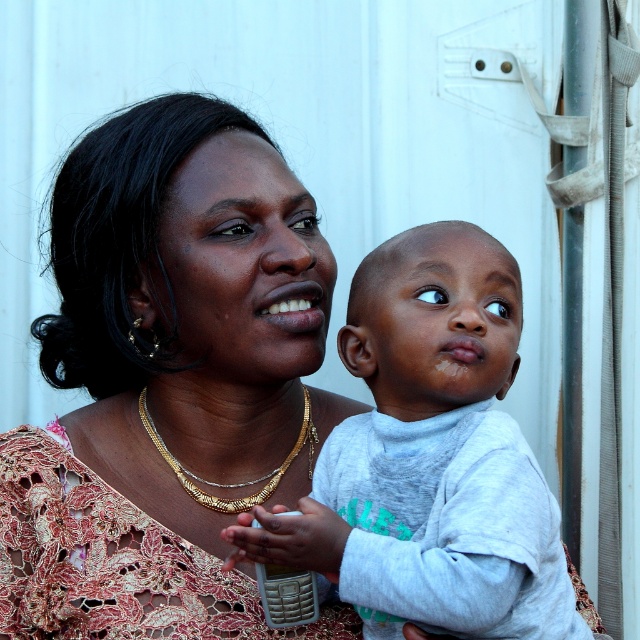
Question: Does matte gold necklace at center have a larger size compared to gray cotton shirt at center?

Choices:
 (A) yes
 (B) no

Answer: (A)

Question: Estimate the real-world distances between objects in this image. Which object is farther from the gold chain necklace at center?

Choices:
 (A) matte gold necklace at center
 (B) gray cotton shirt at center

Answer: (B)

Question: Is matte gold necklace at center positioned behind gray cotton shirt at center?

Choices:
 (A) no
 (B) yes

Answer: (B)

Question: Which object is positioned farthest from the matte gold necklace at center?

Choices:
 (A) gray cotton shirt at center
 (B) gold chain necklace at center

Answer: (A)

Question: Does matte gold necklace at center have a greater width compared to gray cotton shirt at center?

Choices:
 (A) yes
 (B) no

Answer: (A)

Question: Which point is farther to the camera?

Choices:
 (A) gold chain necklace at center
 (B) matte gold necklace at center

Answer: (A)